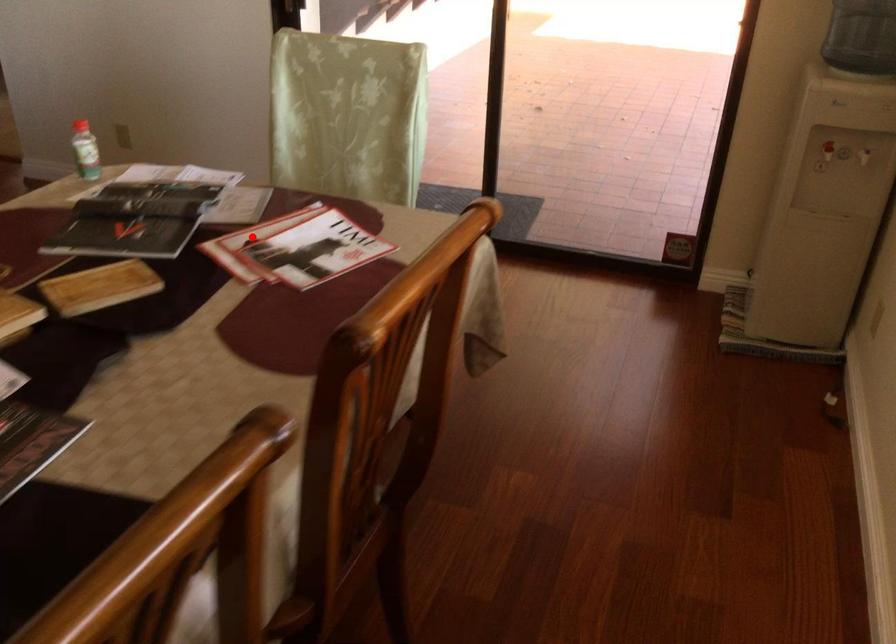
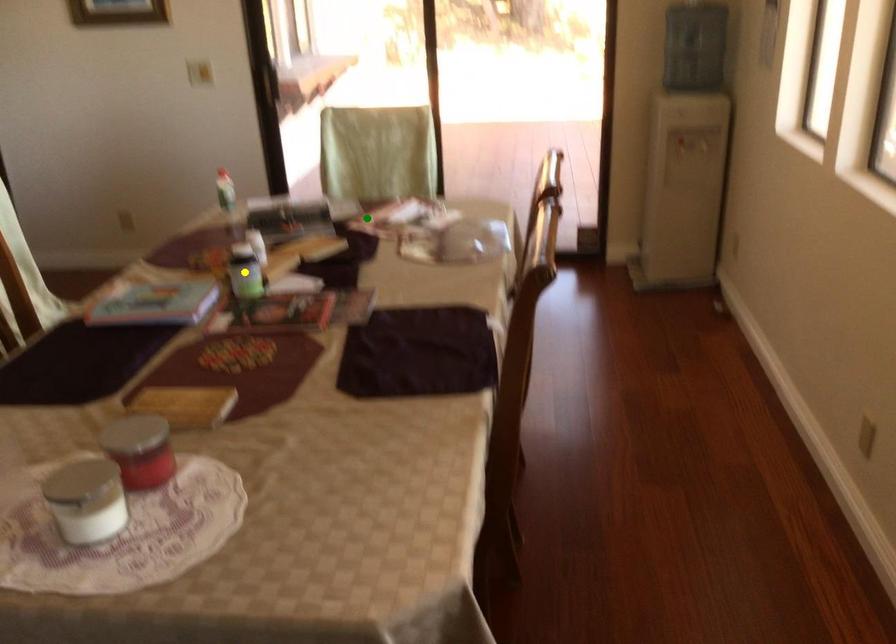
Question: I am providing you with two images of the same scene from different viewpoints. A red point is marked on the first image. You are given multiple points on the second image. Which point in image 2 represents the same 3d spot as the red point in image 1?

Choices:
 (A) green point
 (B) blue point
 (C) yellow point

Answer: (A)